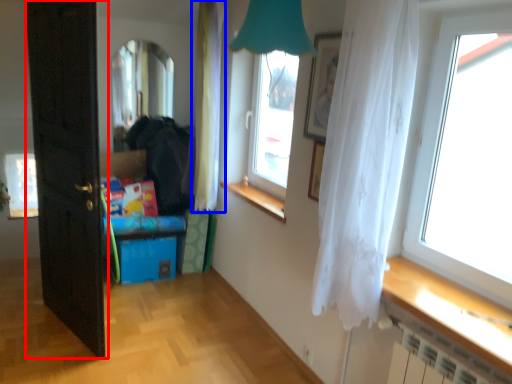
Question: Which point is closer to the camera, door (highlighted by a red box) or curtain (highlighted by a blue box)?

Choices:
 (A) door
 (B) curtain

Answer: (A)